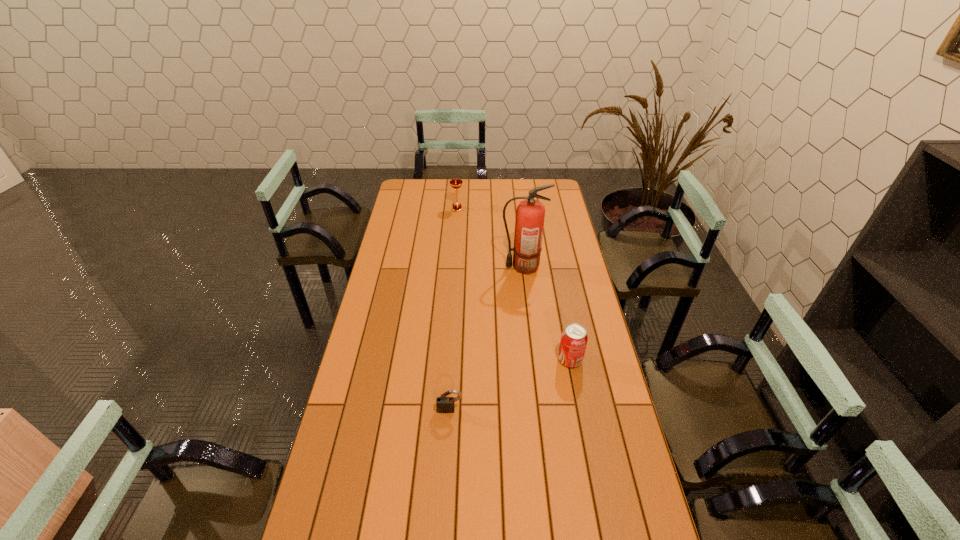
Locate an element on the screen. object that stands as the second closest to the soda is located at coordinates point(529,222).

Find the location of `vacant position in the image that satisfies the following two spatial constraints: 1. on the nozzle of the fire extinguisher; 2. on the left side of the soda`. vacant position in the image that satisfies the following two spatial constraints: 1. on the nozzle of the fire extinguisher; 2. on the left side of the soda is located at coordinates (534, 360).

What are the coordinates of `free space that satisfies the following two spatial constraints: 1. on the nozzle of the tallest object; 2. with the keyhole on the front of the shortest object` in the screenshot? It's located at (540, 410).

The height and width of the screenshot is (540, 960). Identify the location of free region that satisfies the following two spatial constraints: 1. on the back side of the soda; 2. on the nozzle of the tallest object. (552, 267).

Where is `vacant space that satisfies the following two spatial constraints: 1. on the nozzle of the tallest object; 2. with the keyhole on the front of the padlock`? This screenshot has height=540, width=960. vacant space that satisfies the following two spatial constraints: 1. on the nozzle of the tallest object; 2. with the keyhole on the front of the padlock is located at coordinates (540, 410).

Image resolution: width=960 pixels, height=540 pixels. Identify the location of free location that satisfies the following two spatial constraints: 1. on the nozzle of the tallest object; 2. with the keyhole on the front of the padlock. (540, 410).

What are the coordinates of `free point that satisfies the following two spatial constraints: 1. on the nozzle of the second farthest object; 2. on the back side of the soda` in the screenshot? It's located at (534, 360).